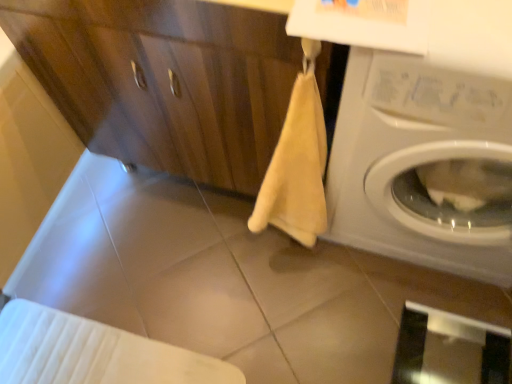
Where is `vacant location below transparent glass screen door at lower right (from a real-world perspective)`? vacant location below transparent glass screen door at lower right (from a real-world perspective) is located at coordinates (451, 353).